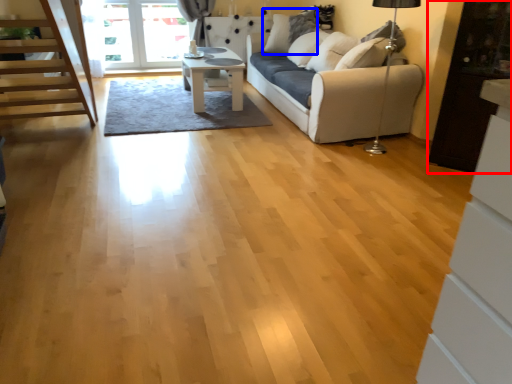
Question: Which point is closer to the camera, cabinetry (highlighted by a red box) or pillow (highlighted by a blue box)?

Choices:
 (A) cabinetry
 (B) pillow

Answer: (A)